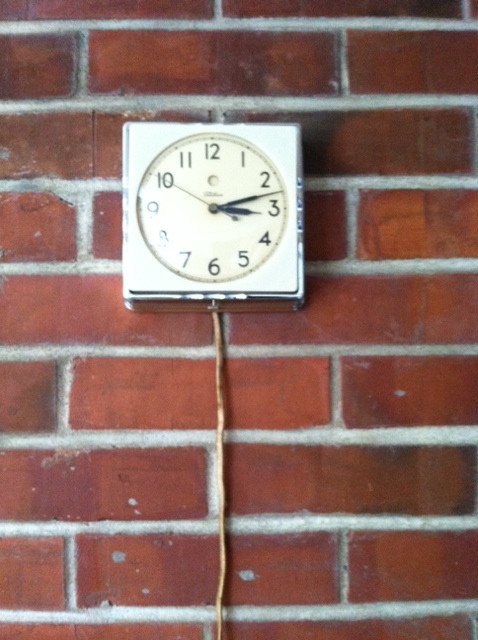
This screenshot has height=640, width=478. I want to click on clock face, so click(190, 212).